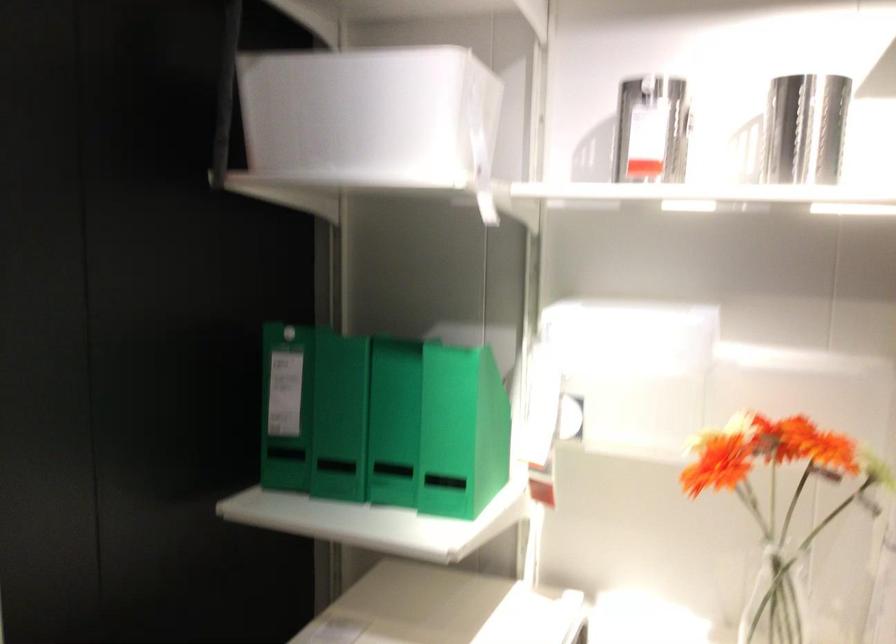
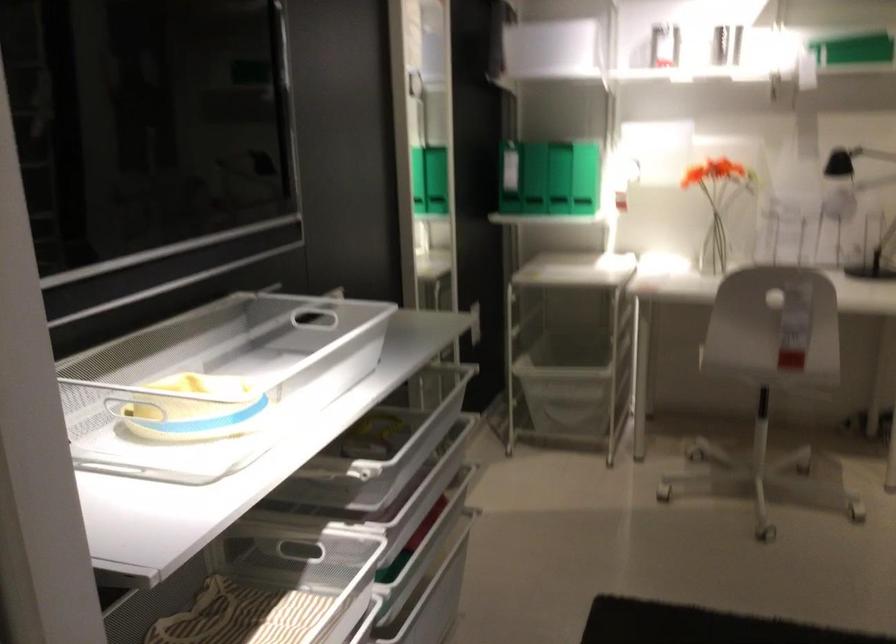
Find the pixel in the second image that matches (325,431) in the first image.

(533, 178)